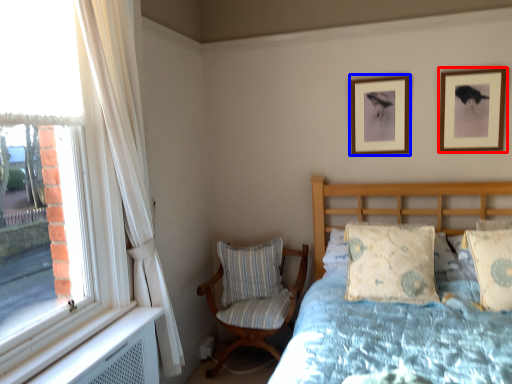
Question: Among these objects, which one is farthest to the camera, picture frame (highlighted by a red box) or picture frame (highlighted by a blue box)?

Choices:
 (A) picture frame
 (B) picture frame

Answer: (B)